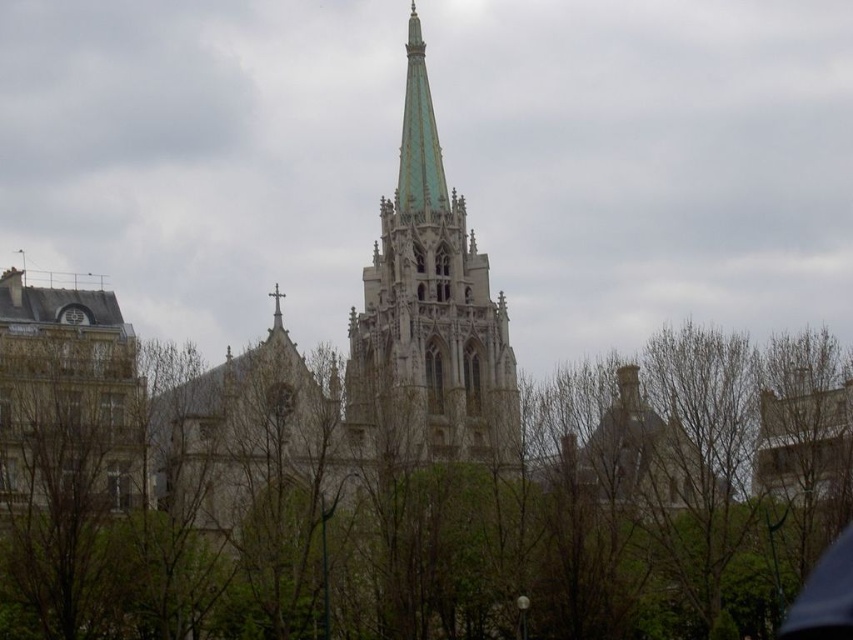
Does green leafy tree at center have a lesser height compared to green stone tower at center?

Correct, green leafy tree at center is not as tall as green stone tower at center.

Can you confirm if green leafy tree at center is wider than green stone tower at center?

Yes, green leafy tree at center is wider than green stone tower at center.

Does point (509, 348) come behind point (474, 282)?

That is False.

This screenshot has height=640, width=853. Find the location of `green leafy tree at center`. green leafy tree at center is located at coordinates pos(381,493).